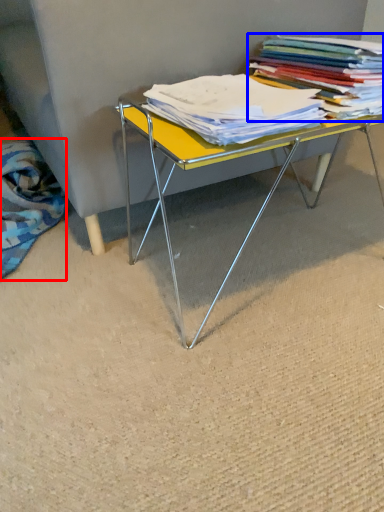
Question: Which point is closer to the camera, fabric (highlighted by a red box) or book (highlighted by a blue box)?

Choices:
 (A) fabric
 (B) book

Answer: (B)